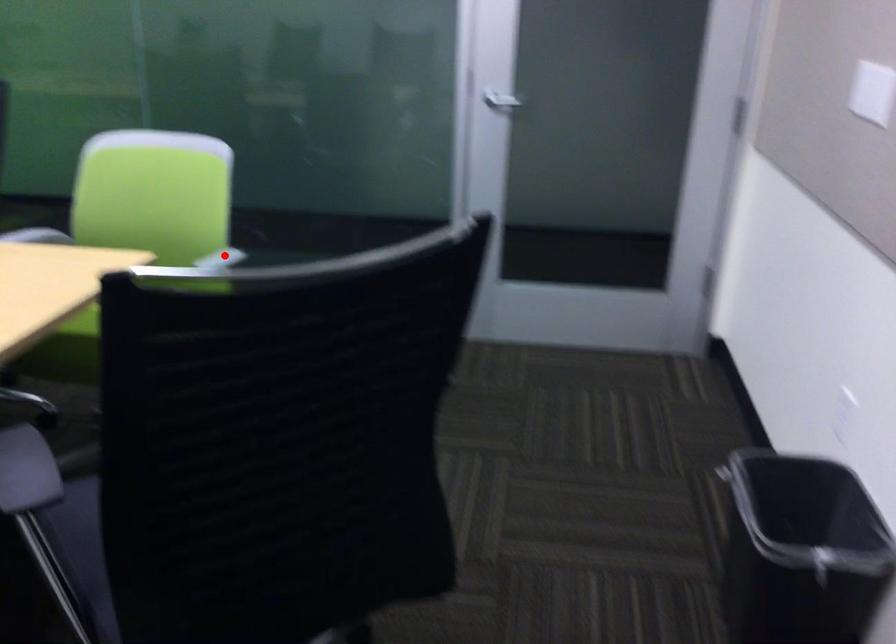
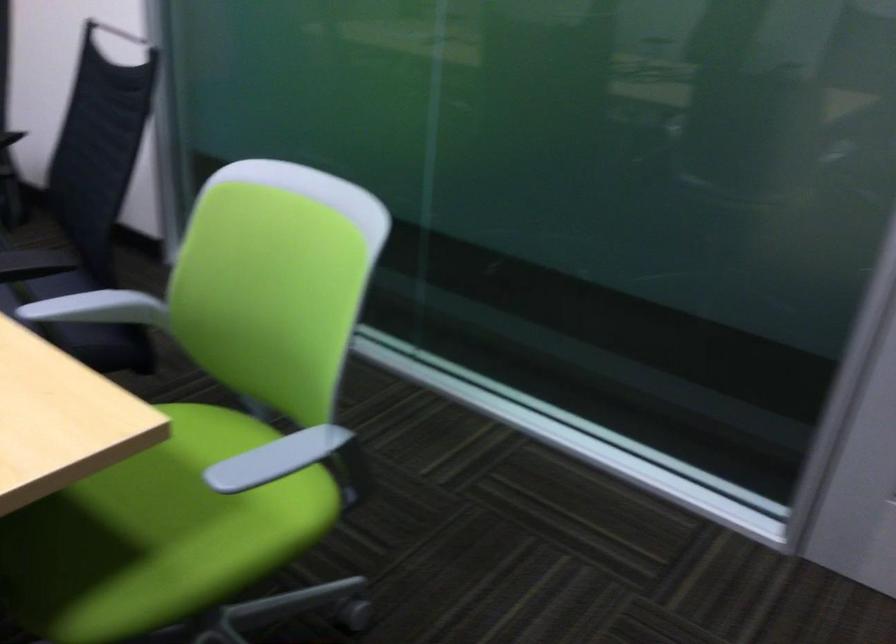
Locate, in the second image, the point that corresponds to the highlighted location in the first image.

(276, 458)